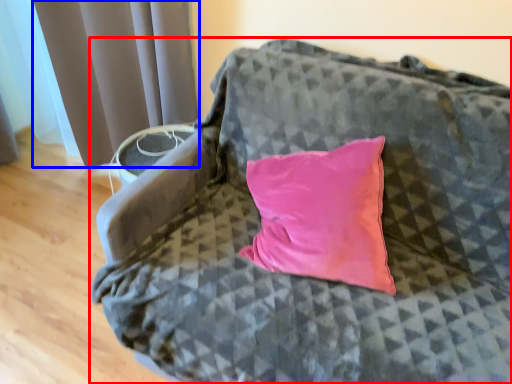
Question: Among these objects, which one is farthest to the camera, furniture (highlighted by a red box) or curtain (highlighted by a blue box)?

Choices:
 (A) furniture
 (B) curtain

Answer: (B)